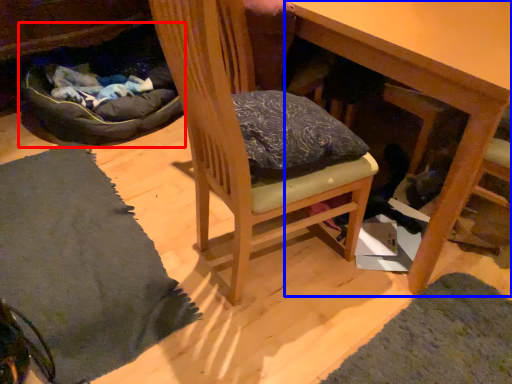
Question: Which object appears farthest to the camera in this image, bean bag chair (highlighted by a red box) or table (highlighted by a blue box)?

Choices:
 (A) bean bag chair
 (B) table

Answer: (A)